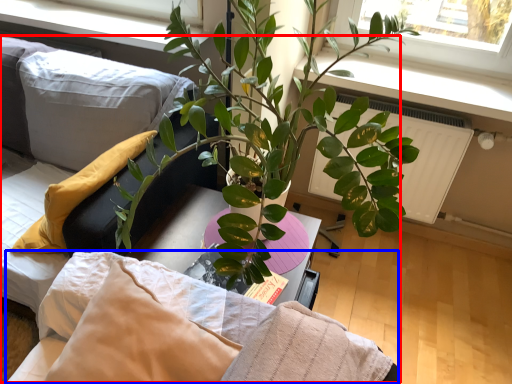
Question: Which object is closer to the camera taking this photo, bed (highlighted by a red box) or bedding (highlighted by a blue box)?

Choices:
 (A) bed
 (B) bedding

Answer: (A)